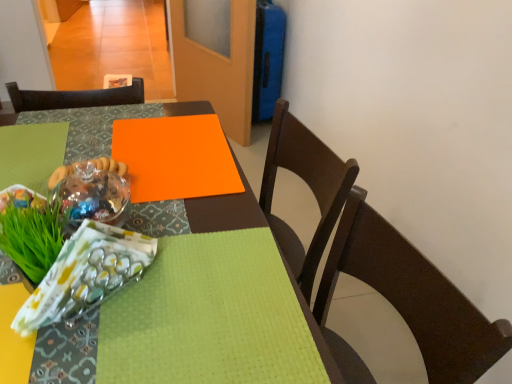
The image size is (512, 384). I want to click on matte brown chair at center, so click(x=407, y=301).

Locate an element on the screen. The image size is (512, 384). translucent plastic bag at lower left is located at coordinates (86, 274).

What is the approximate height of translucent plastic bag at lower left?

It is 5.60 inches.

At what (x,y) coordinates should I click in order to perform the action: click on green leafy grass at lower left. Please return your answer as a coordinate pair (x, y). This screenshot has width=512, height=384. Looking at the image, I should click on (31, 230).

Find the location of a particular element. This screenshot has height=384, width=512. orange matte board at center is located at coordinates (175, 157).

Is translucent glass bowl at center positioned with its back to orange matte board at center?

Yes, translucent glass bowl at center is positioned with its back facing orange matte board at center.

Is the depth of translucent glass bowl at center less than that of orange matte board at center?

Yes, translucent glass bowl at center is in front of orange matte board at center.

How different are the orientations of translucent glass bowl at center and orange matte board at center in degrees?

8.52 degrees separate the facing orientations of translucent glass bowl at center and orange matte board at center.

Is translucent glass bowl at center thinner than orange matte board at center?

Indeed, translucent glass bowl at center has a lesser width compared to orange matte board at center.

In the scene shown: Who is more distant, green leafy grass at lower left or matte brown chair at center?

green leafy grass at lower left is more distant.

Is point (38, 266) in front of point (371, 211)?

Yes, it is in front of point (371, 211).

Is green leafy grass at lower left not near matte brown chair at center?

No.

From the image's perspective, between green leafy grass at lower left and matte brown chair at center, who is located below?

matte brown chair at center appears lower in the image.

From a real-world perspective, is orange matte board at center beneath matte brown chair at center?

Incorrect, from a real-world perspective, orange matte board at center is higher than matte brown chair at center.

Considering their positions, is orange matte board at center located in front of or behind matte brown chair at center?

orange matte board at center is behind matte brown chair at center.

From the image's perspective, is orange matte board at center under matte brown chair at center?

No, from the image's perspective, orange matte board at center is not beneath matte brown chair at center.

At what (x,y) coordinates should I click in order to perform the action: click on chair below the orange matte board at center (from the image's perspective). Please return your answer as a coordinate pair (x, y). This screenshot has height=384, width=512. Looking at the image, I should click on (407, 301).

Which is behind, point (37, 268) or point (203, 158)?

The point (203, 158) is farther from the camera.

Can you tell me how much green leafy grass at lower left and orange matte board at center differ in facing direction?

There is a 2.63-degree angle between the facing directions of green leafy grass at lower left and orange matte board at center.

Can you confirm if green leafy grass at lower left is thinner than orange matte board at center?

Yes, green leafy grass at lower left is thinner than orange matte board at center.

Is green leafy grass at lower left positioned in front of orange matte board at center?

Yes, green leafy grass at lower left is in front of orange matte board at center.

Is the position of matte orange placemat at center less distant than that of translucent glass bowl at center?

Yes.

From the image's perspective, which is below, matte orange placemat at center or translucent glass bowl at center?

matte orange placemat at center, from the image's perspective.

From a real-world perspective, which is physically below, matte orange placemat at center or translucent glass bowl at center?

In real-world perspective, matte orange placemat at center is lower.

Is matte orange placemat at center oriented away from translucent glass bowl at center?

No, matte orange placemat at center's orientation is not away from translucent glass bowl at center.

Identify the location of grass on the left side of translucent glass bowl at center. click(x=31, y=230).

Does translucent glass bowl at center turn towards green leafy grass at lower left?

No, translucent glass bowl at center is not turned towards green leafy grass at lower left.

Considering the sizes of translucent glass bowl at center and green leafy grass at lower left in the image, is translucent glass bowl at center wider or thinner than green leafy grass at lower left?

translucent glass bowl at center is wider than green leafy grass at lower left.

From the picture: Who is taller, translucent glass bowl at center or green leafy grass at lower left?

With more height is green leafy grass at lower left.

From the image's perspective, which is below, orange matte board at center or matte orange placemat at center?

matte orange placemat at center.

Can you tell me how much orange matte board at center and matte orange placemat at center differ in facing direction?

The angle between the facing direction of orange matte board at center and the facing direction of matte orange placemat at center is 1.75 degrees.

Considering the relative sizes of orange matte board at center and matte orange placemat at center in the image provided, is orange matte board at center taller than matte orange placemat at center?

In fact, orange matte board at center may be shorter than matte orange placemat at center.

Does orange matte board at center come behind matte orange placemat at center?

That is True.

The image size is (512, 384). In the image, there is a translucent glass bowl at center. In order to click on linen above it (from the image's perspective) in this screenshot , I will do `click(175, 157)`.

In the image, there is a green leafy grass at lower left. At what (x,y) coordinates should I click in order to perform the action: click on chair below it (from a real-world perspective). Please return your answer as a coordinate pair (x, y). The height and width of the screenshot is (384, 512). Looking at the image, I should click on (407, 301).

Based on their spatial positions, is translucent plastic bag at lower left or matte brown chair at center further from orange matte board at center?

The object further to orange matte board at center is matte brown chair at center.

Looking at the image, which one is located closer to translucent plastic bag at lower left, translucent glass bowl at center or matte brown chair at center?

The object closer to translucent plastic bag at lower left is translucent glass bowl at center.

Looking at the image, which one is located further to green leafy grass at lower left, translucent glass bowl at center or translucent plastic bag at lower left?

Based on the image, translucent glass bowl at center appears to be further to green leafy grass at lower left.

From the image, which object appears to be farther from matte brown chair at center, translucent glass bowl at center or matte orange placemat at center?

translucent glass bowl at center is further to matte brown chair at center.

Considering their positions, is translucent glass bowl at center positioned further to matte orange placemat at center than orange matte board at center?

translucent glass bowl at center is further to matte orange placemat at center.

Considering their positions, is matte brown chair at center positioned further to translucent glass bowl at center than green leafy grass at lower left?

Among the two, matte brown chair at center is located further to translucent glass bowl at center.

Looking at the image, which one is located further to translucent glass bowl at center, matte orange placemat at center or orange matte board at center?

The object further to translucent glass bowl at center is matte orange placemat at center.

From the image, which object appears to be farther from translucent plastic bag at lower left, translucent glass bowl at center or orange matte board at center?

orange matte board at center lies further to translucent plastic bag at lower left than the other object.

Identify the location of material between green leafy grass at lower left and matte brown chair at center in the horizontal direction. (86, 274).

Where is `grass between translucent plastic bag at lower left and translucent glass bowl at center in the front-back direction`? Image resolution: width=512 pixels, height=384 pixels. grass between translucent plastic bag at lower left and translucent glass bowl at center in the front-back direction is located at coordinates [x=31, y=230].

Locate an element on the screen. The width and height of the screenshot is (512, 384). material between translucent glass bowl at center and matte brown chair at center from top to bottom is located at coordinates (86, 274).

Locate an element on the screen. material between matte orange placemat at center and matte brown chair at center is located at coordinates (86, 274).